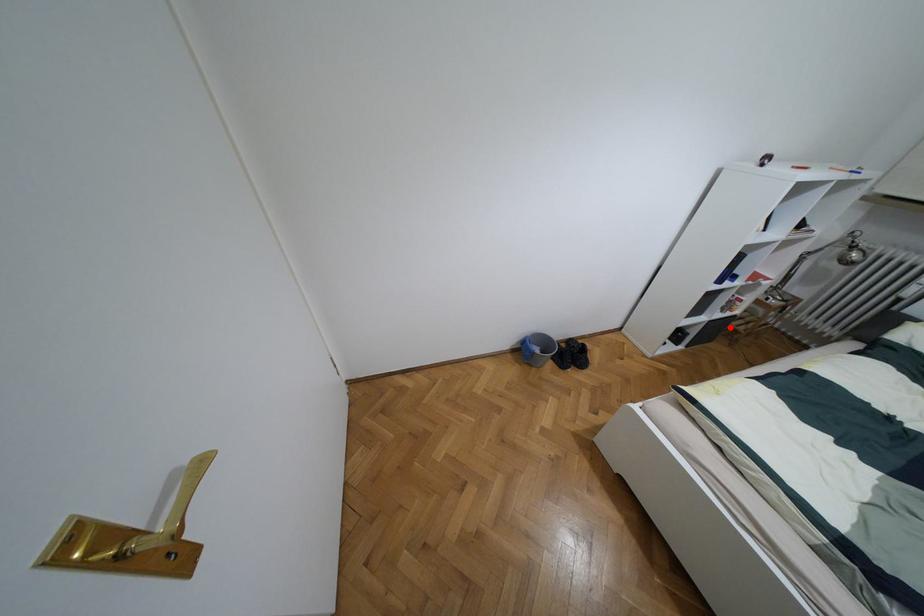
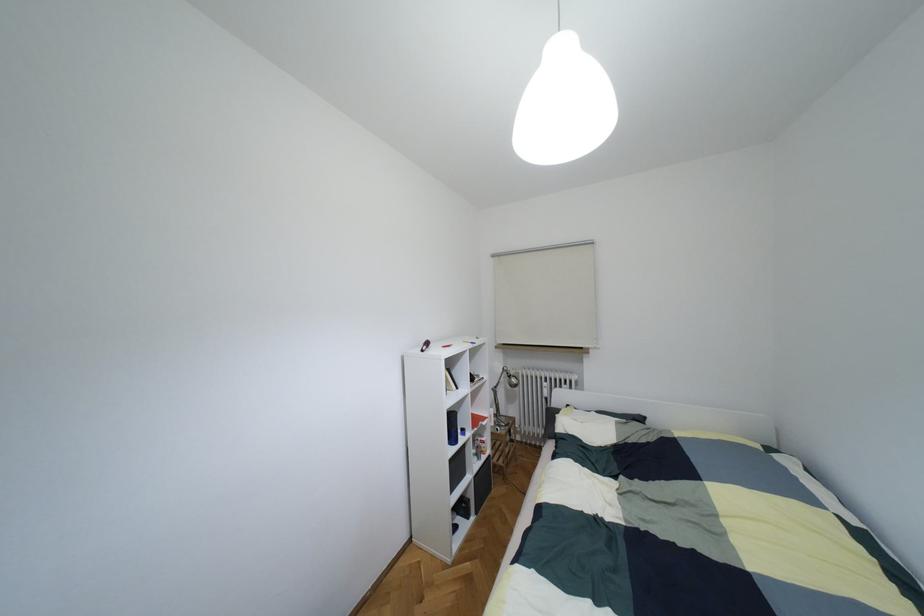
Question: I am providing you with two images of the same scene from different viewpoints. Given a red point in image1, look at the same physical point in image2. Is it:

Choices:
 (A) Closer to the viewpoint
 (B) Farther from the viewpoint

Answer: (B)